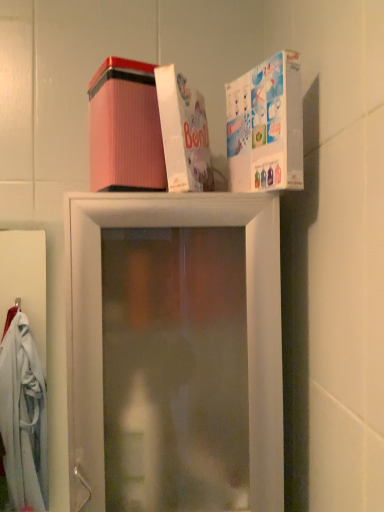
Question: Is white glossy box at upper right, the 3th box viewed from the left, positioned beyond the bounds of white cardboard box at upper center, placed as the 2th box when sorted from right to left?

Choices:
 (A) yes
 (B) no

Answer: (A)

Question: Does white glossy box at upper right, the 3th box viewed from the left, have a smaller size compared to white cardboard box at upper center, which is the second box in left-to-right order?

Choices:
 (A) yes
 (B) no

Answer: (A)

Question: From a real-world perspective, is white glossy box at upper right, the 3th box viewed from the left, positioned over white cardboard box at upper center, which is the second box in left-to-right order, based on gravity?

Choices:
 (A) no
 (B) yes

Answer: (A)

Question: Does white glossy box at upper right, which is the first box in right-to-left order, appear on the right side of white cardboard box at upper center, which is the second box in left-to-right order?

Choices:
 (A) yes
 (B) no

Answer: (A)

Question: Would you say white cardboard box at upper center, placed as the 2th box when sorted from right to left, is part of white glossy box at upper right, the 3th box viewed from the left,'s contents?

Choices:
 (A) no
 (B) yes

Answer: (A)

Question: From a real-world perspective, is white glossy box at upper right, the 3th box viewed from the left, under white cardboard box at upper center, placed as the 2th box when sorted from right to left?

Choices:
 (A) yes
 (B) no

Answer: (A)

Question: Is pink corrugated box at upper center, the first box positioned from the left, behind white glossy box at upper right, which is the first box in right-to-left order?

Choices:
 (A) yes
 (B) no

Answer: (A)

Question: Is pink corrugated box at upper center, arranged as the 3th box when viewed from the right, outside white glossy box at upper right, the 3th box viewed from the left?

Choices:
 (A) yes
 (B) no

Answer: (A)

Question: Is pink corrugated box at upper center, arranged as the 3th box when viewed from the right, looking in the opposite direction of white glossy box at upper right, which is the first box in right-to-left order?

Choices:
 (A) no
 (B) yes

Answer: (A)

Question: From a real-world perspective, is pink corrugated box at upper center, the first box positioned from the left, positioned under white glossy box at upper right, the 3th box viewed from the left, based on gravity?

Choices:
 (A) no
 (B) yes

Answer: (A)

Question: Considering the relative positions of pink corrugated box at upper center, the first box positioned from the left, and white glossy box at upper right, which is the first box in right-to-left order, in the image provided, is pink corrugated box at upper center, the first box positioned from the left, to the right of white glossy box at upper right, which is the first box in right-to-left order, from the viewer's perspective?

Choices:
 (A) no
 (B) yes

Answer: (A)

Question: Can you confirm if pink corrugated box at upper center, arranged as the 3th box when viewed from the right, is shorter than white glossy box at upper right, which is the first box in right-to-left order?

Choices:
 (A) yes
 (B) no

Answer: (A)

Question: Can you confirm if white cardboard box at upper center, placed as the 2th box when sorted from right to left, is smaller than white glossy box at upper right, which is the first box in right-to-left order?

Choices:
 (A) no
 (B) yes

Answer: (A)